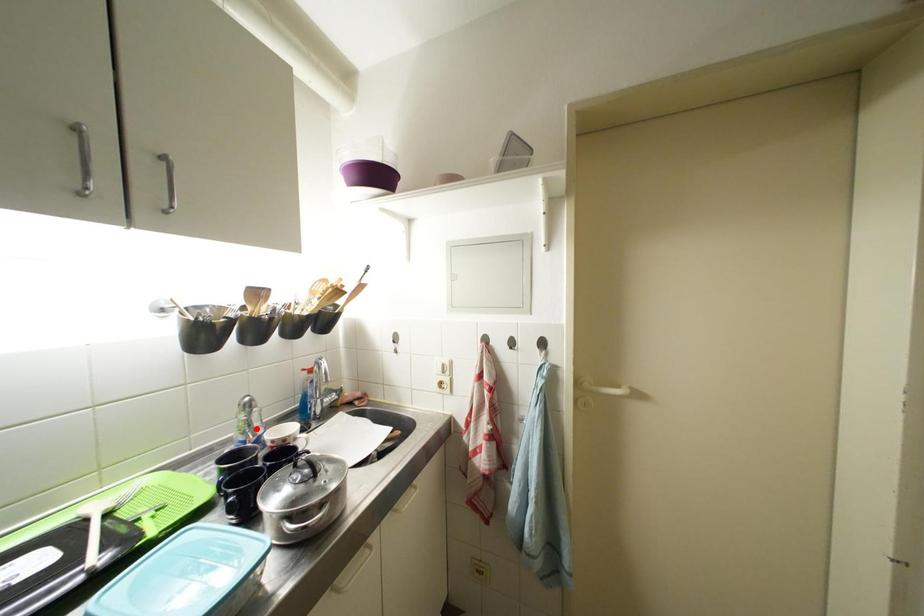
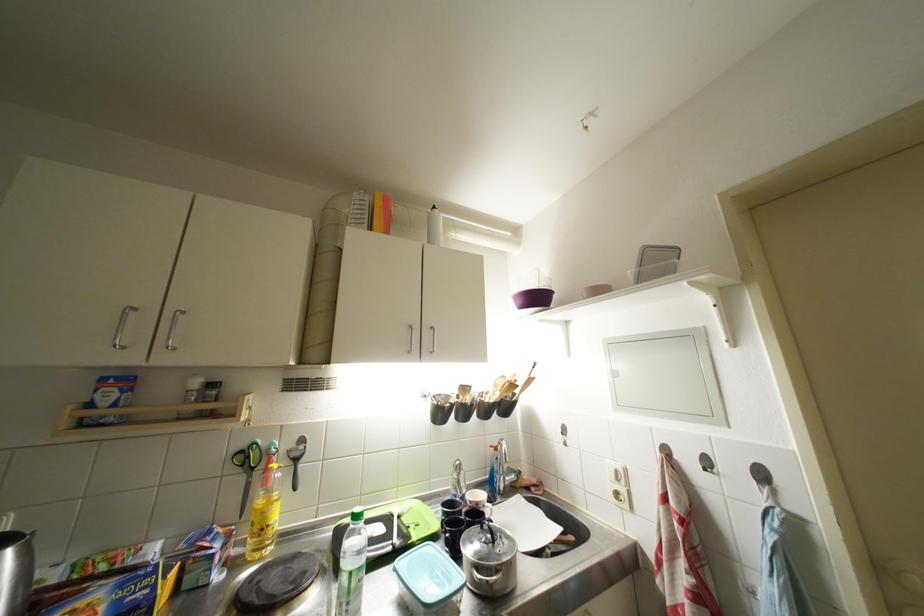
Where in the second image is the point corresponding to the highlighted location from the first image?

(466, 487)